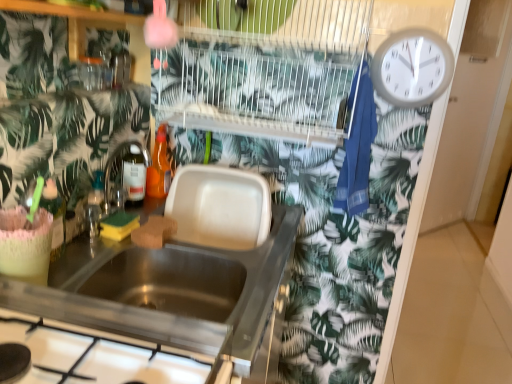
Question: In the image, is stainless steel gas stove at lower left on the left side or the right side of brown sponge at sink, acting as the 2th food starting from the left?

Choices:
 (A) right
 (B) left

Answer: (B)

Question: Looking at the image, does stainless steel gas stove at lower left seem bigger or smaller compared to brown sponge at sink, placed as the first food when sorted from right to left?

Choices:
 (A) big
 (B) small

Answer: (A)

Question: Which is farther from the translucent orange bottle at sink, the 1th bottle positioned from the back?

Choices:
 (A) metallic stainless steel sink at center
 (B) translucent plastic bottle at left, positioned as the second bottle in top-to-bottom order
 (C) stainless steel gas stove at lower left
 (D) green sponge at sink, positioned as the first food in left-to-right order
 (E) brown sponge at sink, acting as the 2th food starting from the left

Answer: (C)

Question: Which is nearer to the stainless steel gas stove at lower left?

Choices:
 (A) green sponge at sink, positioned as the first food in left-to-right order
 (B) white plastic wall clock at upper right
 (C) translucent orange bottle at sink, the 1th bottle positioned from the back
 (D) brown sponge at sink, placed as the first food when sorted from right to left
 (E) metallic stainless steel sink at center

Answer: (E)